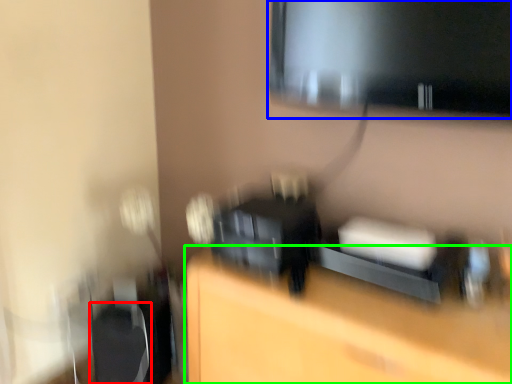
Question: Which is farther away from swivel chair (highlighted by a red box)? computer monitor (highlighted by a blue box) or furniture (highlighted by a green box)?

Choices:
 (A) computer monitor
 (B) furniture

Answer: (A)